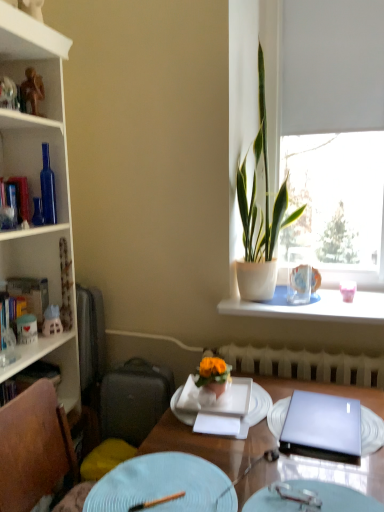
Question: Considering the relative sizes of white ceramic vase at upper right and light blue ceramic plate at center, marked as the 2th plate in a front-to-back arrangement, in the image provided, is white ceramic vase at upper right wider than light blue ceramic plate at center, marked as the 2th plate in a front-to-back arrangement,?

Choices:
 (A) yes
 (B) no

Answer: (A)

Question: Is white ceramic vase at upper right not near light blue ceramic plate at center, marked as the 2th plate in a front-to-back arrangement?

Choices:
 (A) no
 (B) yes

Answer: (A)

Question: Does white ceramic vase at upper right appear on the right side of light blue ceramic plate at center, marked as the 2th plate in a front-to-back arrangement?

Choices:
 (A) no
 (B) yes

Answer: (B)

Question: Does white ceramic vase at upper right have a smaller size compared to light blue ceramic plate at center, marked as the 2th plate in a front-to-back arrangement?

Choices:
 (A) no
 (B) yes

Answer: (A)

Question: Does white ceramic vase at upper right lie behind light blue ceramic plate at center, which is the 2th plate from back to front?

Choices:
 (A) yes
 (B) no

Answer: (A)

Question: Could you tell me if white ceramic vase at upper right is turned towards light blue ceramic plate at center, which is the 2th plate from back to front?

Choices:
 (A) no
 (B) yes

Answer: (A)

Question: Is hardcover book at left, acting as the first book starting from the top, surrounded by wooden chopstick at lower center, which appears as the 3th tableware when viewed from the right?

Choices:
 (A) yes
 (B) no

Answer: (B)

Question: Is the depth of wooden chopstick at lower center, positioned as the first tableware in front-to-back order, less than that of hardcover book at left, acting as the first book starting from the top?

Choices:
 (A) no
 (B) yes

Answer: (B)

Question: Can you confirm if wooden chopstick at lower center, the 3th tableware viewed from the top, is bigger than hardcover book at left, acting as the first book starting from the top?

Choices:
 (A) yes
 (B) no

Answer: (B)

Question: Is the depth of wooden chopstick at lower center, the 3th tableware viewed from the top, greater than that of hardcover book at left, which is counted as the third book, starting from the bottom?

Choices:
 (A) no
 (B) yes

Answer: (A)

Question: From a real-world perspective, is wooden chopstick at lower center, the 3th tableware viewed from the top, beneath hardcover book at left, which is counted as the third book, starting from the bottom?

Choices:
 (A) no
 (B) yes

Answer: (B)

Question: Would you say wooden chopstick at lower center, positioned as the first tableware in front-to-back order, is outside hardcover book at left, acting as the first book starting from the top?

Choices:
 (A) yes
 (B) no

Answer: (A)

Question: Is hardcover book at left, which appears as the second book when viewed from the top, closer to camera compared to white plastic radiator at lower center?

Choices:
 (A) yes
 (B) no

Answer: (B)